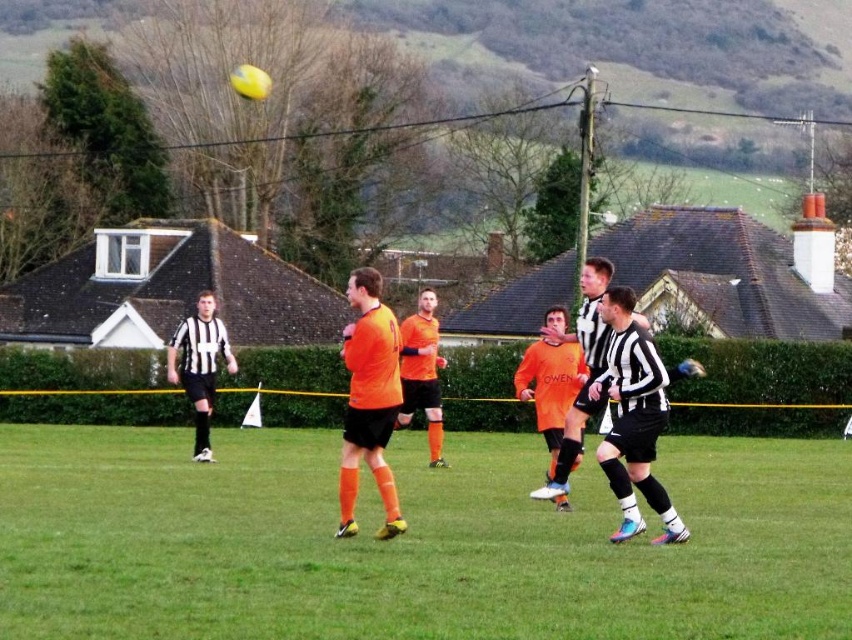
You are a soccer player trying to kick the ball towards the goal. You notice the green grass at center and the orange matte jersey at center. Which object is wider in this scene?

The green grass at center is wider than the orange matte jersey at center.